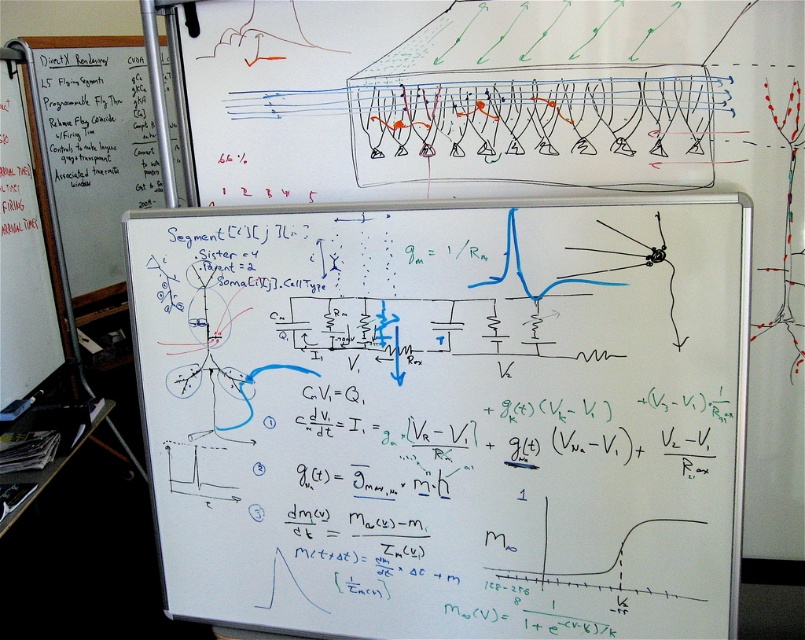
You are a student trying to write a large equation on the whiteboard at center and the whiteboard paper at left. Which surface allows you to write taller equations without needing to bend down?

The whiteboard paper at left is taller than the whiteboard at center, so you can write taller equations on the whiteboard paper at left without bending down.

In the scene shown: You are a student who needs to write a long equation that requires more space. Which object between the whiteboard at center and the whiteboard paper at left should you choose?

The whiteboard at center has a larger width than the whiteboard paper at left, so you should choose the whiteboard at center to write the long equation.